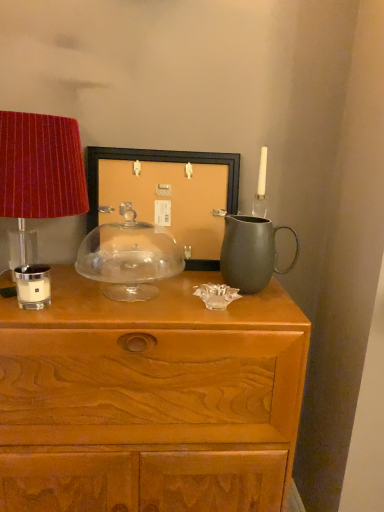
Locate an element on the screen. Image resolution: width=384 pixels, height=512 pixels. vacant space situated above wooden chest of drawers at center (from a real-world perspective) is located at coordinates (147, 293).